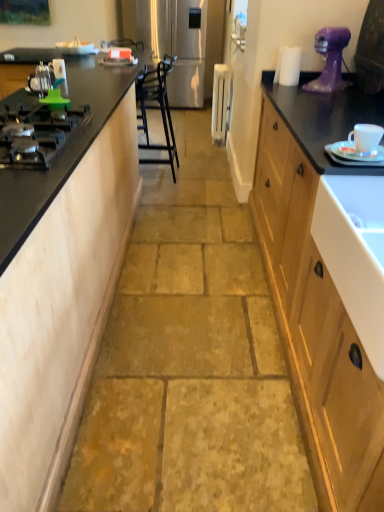
Question: Which direction should I rotate to face white plastic radiator at center, the 2th appliance when ordered from back to front, — up or down?

Choices:
 (A) down
 (B) up

Answer: (B)

Question: Is white glossy saucer at right not inside stainless steel refrigerator at center, which is the 1th appliance in back-to-front order?

Choices:
 (A) no
 (B) yes

Answer: (B)

Question: From a real-world perspective, does white glossy saucer at right sit lower than stainless steel refrigerator at center, acting as the fourth appliance starting from the front?

Choices:
 (A) yes
 (B) no

Answer: (B)

Question: Can you confirm if white glossy saucer at right is positioned to the left of stainless steel refrigerator at center, which is the second appliance from left to right?

Choices:
 (A) no
 (B) yes

Answer: (A)

Question: Is white glossy saucer at right oriented away from stainless steel refrigerator at center, acting as the fourth appliance starting from the front?

Choices:
 (A) no
 (B) yes

Answer: (A)

Question: Is white glossy saucer at right aimed at stainless steel refrigerator at center, which is the 1th appliance in back-to-front order?

Choices:
 (A) no
 (B) yes

Answer: (A)

Question: From the image's perspective, is white glossy saucer at right below stainless steel refrigerator at center, which is the 1th appliance in back-to-front order?

Choices:
 (A) no
 (B) yes

Answer: (B)

Question: Is stainless steel refrigerator at center, which is the 1th appliance in back-to-front order, shorter than black matte gas stove at left?

Choices:
 (A) no
 (B) yes

Answer: (A)

Question: Is stainless steel refrigerator at center, the 3th appliance viewed from the right, in front of black matte gas stove at left?

Choices:
 (A) no
 (B) yes

Answer: (A)

Question: Are stainless steel refrigerator at center, which is the second appliance from left to right, and black matte gas stove at left located far from each other?

Choices:
 (A) yes
 (B) no

Answer: (A)

Question: Is stainless steel refrigerator at center, the 3th appliance viewed from the right, smaller than black matte gas stove at left?

Choices:
 (A) yes
 (B) no

Answer: (B)

Question: Considering the relative positions of stainless steel refrigerator at center, the 3th appliance viewed from the right, and black matte gas stove at left in the image provided, is stainless steel refrigerator at center, the 3th appliance viewed from the right, to the right of black matte gas stove at left from the viewer's perspective?

Choices:
 (A) yes
 (B) no

Answer: (A)

Question: From a real-world perspective, is stainless steel refrigerator at center, which is the second appliance from left to right, located higher than black matte gas stove at left?

Choices:
 (A) no
 (B) yes

Answer: (A)

Question: Is purple plastic mixer at upper right next to black matte gas stove at left and touching it?

Choices:
 (A) no
 (B) yes

Answer: (A)